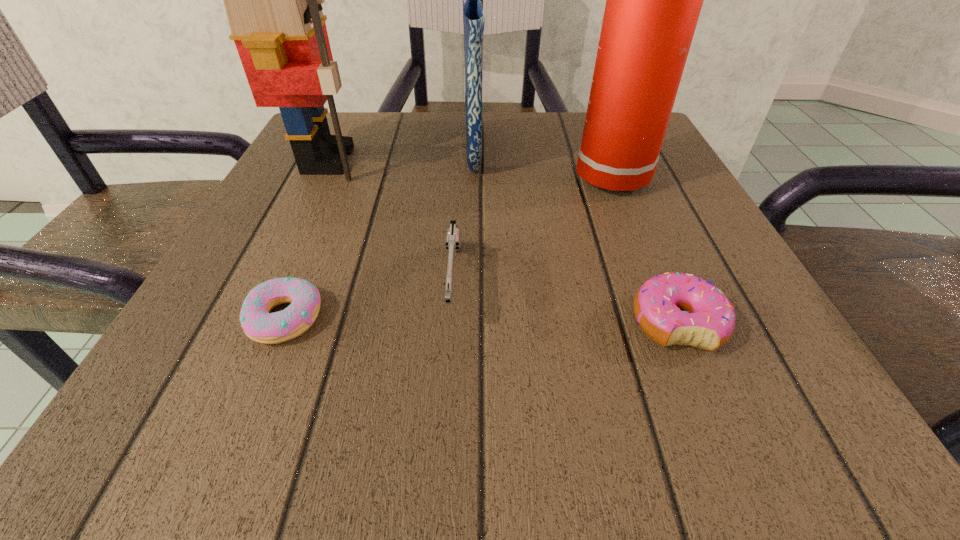
The image size is (960, 540). In order to click on shopping bag in this screenshot , I will do `click(473, 17)`.

Where is `fire extinguisher`? Image resolution: width=960 pixels, height=540 pixels. fire extinguisher is located at coordinates (653, 0).

Find the location of `nutcracker`. nutcracker is located at coordinates (273, 0).

Image resolution: width=960 pixels, height=540 pixels. Find the location of `the third shortest object`. the third shortest object is located at coordinates (453, 235).

Where is `the right doughnut`? Image resolution: width=960 pixels, height=540 pixels. the right doughnut is located at coordinates (681, 309).

I want to click on the taller doughnut, so click(x=681, y=309).

Identify the location of the shorter doughnut. (258, 324).

Identify the location of the left doughnut. (258, 324).

This screenshot has width=960, height=540. In order to click on free spot located 0.340m on the front-facing side of the shopping bag in this screenshot , I will do (x=659, y=146).

I want to click on vacant space located 0.050m at the nozzle of the fire extinguisher, so click(x=547, y=178).